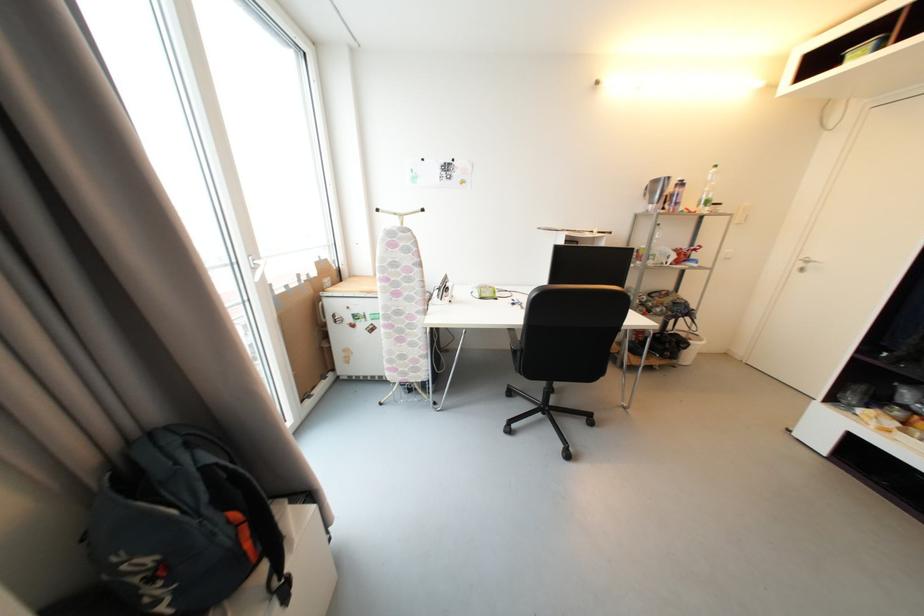
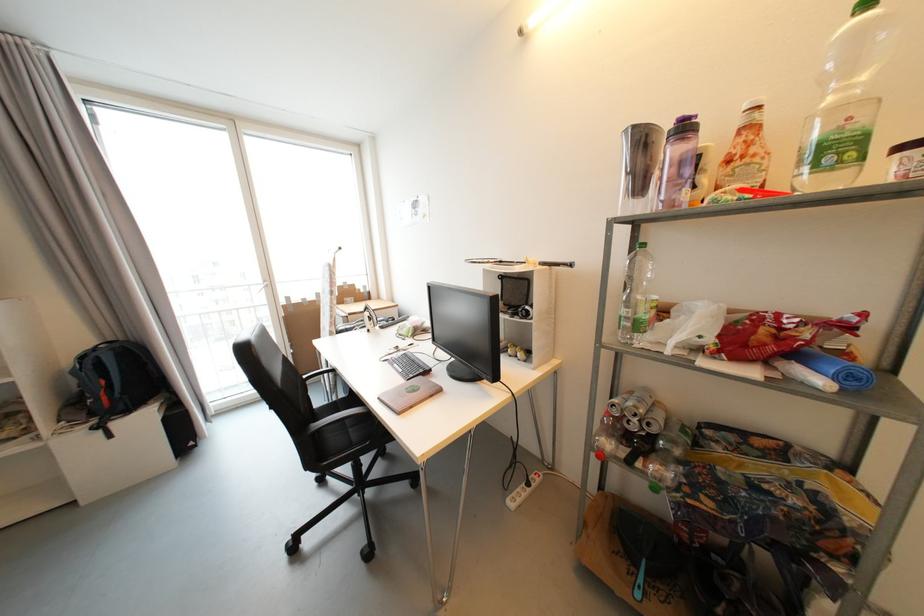
The point at (687, 185) is marked in the first image. Where is the corresponding point in the second image?

(689, 130)